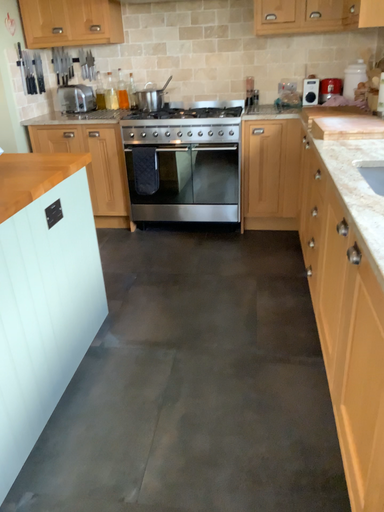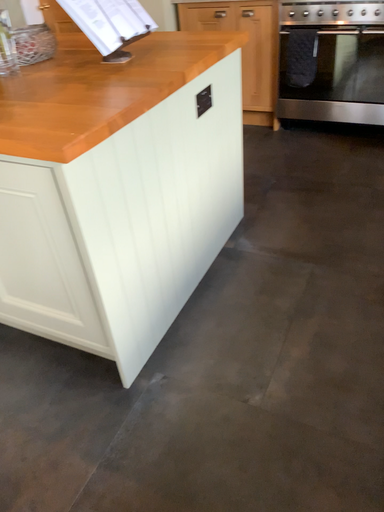
Question: How did the camera likely rotate when shooting the video?

Choices:
 (A) rotated left
 (B) rotated right

Answer: (A)